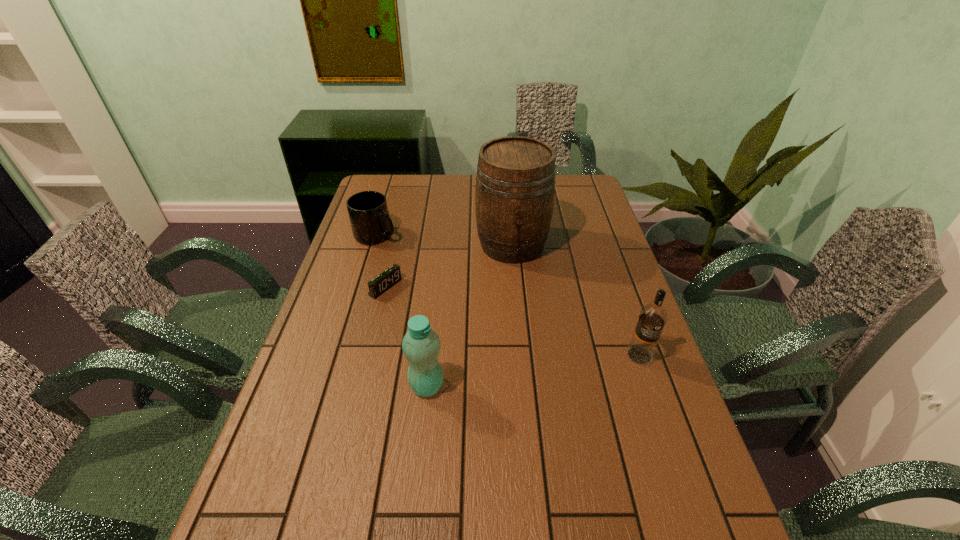
This screenshot has width=960, height=540. Identify the location of vacant area between the vodka and the third farthest object. (513, 321).

Where is `free spot between the alarm clock and the cider`? The width and height of the screenshot is (960, 540). free spot between the alarm clock and the cider is located at coordinates (448, 266).

This screenshot has height=540, width=960. I want to click on vacant space that's between the second shortest object and the rightmost object, so click(x=508, y=295).

At what (x,y) coordinates should I click in order to perform the action: click on vacant area that lies between the nearest object and the mug. Please return your answer as a coordinate pair (x, y). Looking at the image, I should click on (401, 310).

Identify which object is the third closest to the shortest object. Please provide its 2D coordinates. Your answer should be formatted as a tuple, i.e. [(x, y)], where the tuple contains the x and y coordinates of a point satisfying the conditions above.

[(421, 345)]

Identify which object is located as the second nearest to the second shortest object. Please provide its 2D coordinates. Your answer should be formatted as a tuple, i.e. [(x, y)], where the tuple contains the x and y coordinates of a point satisfying the conditions above.

[(515, 182)]

I want to click on free region that satisfies the following two spatial constraints: 1. on the back side of the alarm clock; 2. on the left side of the fourth object from left to right, so click(x=396, y=245).

This screenshot has height=540, width=960. Identify the location of vacant space that satisfies the following two spatial constraints: 1. on the front side of the mug; 2. on the left side of the third object from right to left. (330, 386).